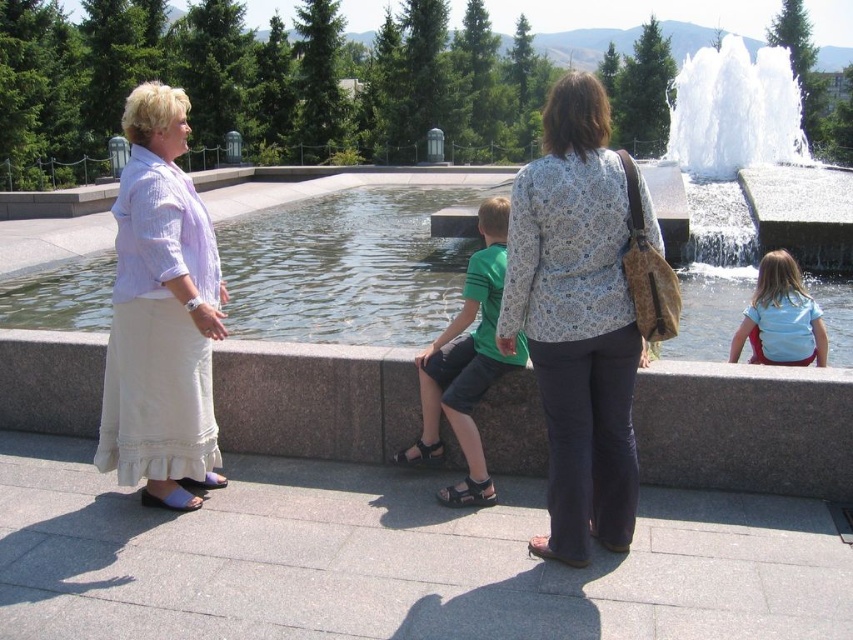
You are a photographer standing at the edge of the water feature in the park. You want to capture a photo that includes both the white frothy water at upper center and the light blue fabric at lower right. Based on their sizes, which object should you zoom in more on to ensure both fit in the frame?

The white frothy water at upper center might be wider than light blue fabric at lower right, so you should zoom in more on the light blue fabric at lower right to ensure both fit in the frame.

Based on the scene description, which of the two water features, the clear water at fountain center or the white frothy water at upper center, is lower in height?

The clear water at fountain center is lower in height compared to the white frothy water at upper center.